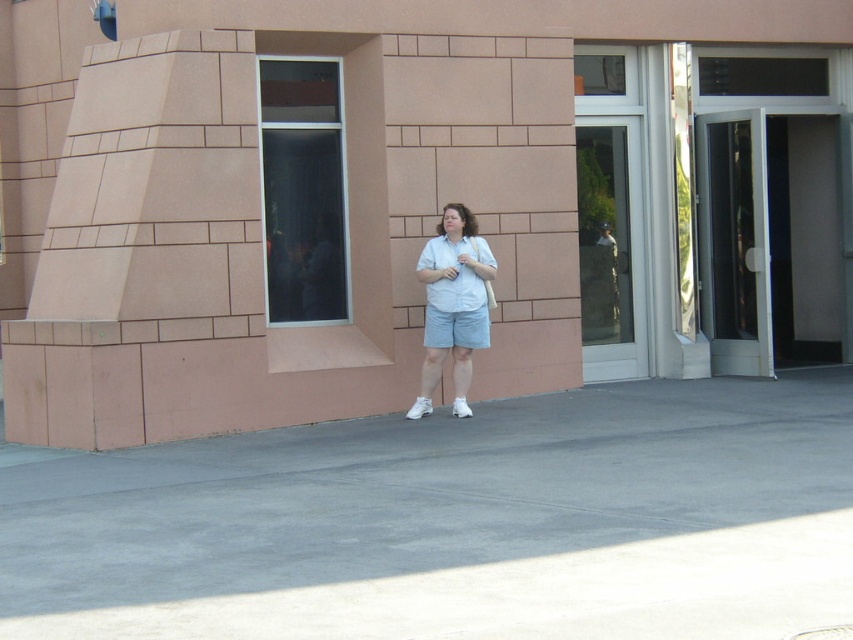
You are a delivery person standing on the gray concrete pavement at center. You need to place a package at the location where the light blue denim shorts at center is. Can you directly place the package there without moving from your current position?

The gray concrete pavement at center is in front of the light blue denim shorts at center, so you cannot directly place the package there without moving forward to reach the position of the light blue denim shorts at center.

You are a fashion designer observing a person dressed in light blue denim shorts at center and light blue cotton shirt at center. Which clothing item is taller?

The light blue denim shorts at center is taller than the light blue cotton shirt at center.

You are standing at the point marked by the coordinates point (x=454, y=524) in the image. What is the material of the surface you are currently standing on?

The point (x=454, y=524) marks gray concrete pavement at center, so the material is gray concrete.